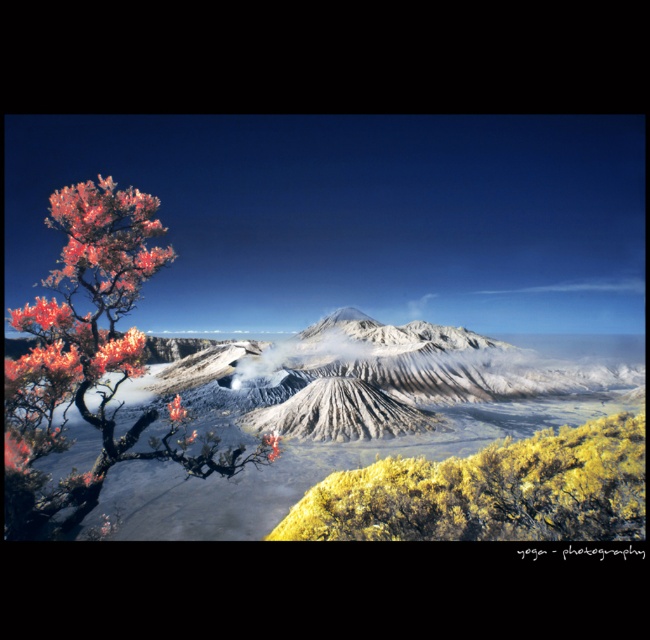
Question: Does fluorescent orange bark at left lie behind yellow-green shrubbery at lower right?

Choices:
 (A) no
 (B) yes

Answer: (B)

Question: Is fluorescent orange bark at left wider than yellow-green shrubbery at lower right?

Choices:
 (A) no
 (B) yes

Answer: (B)

Question: Is fluorescent orange bark at left above yellow-green shrubbery at lower right?

Choices:
 (A) yes
 (B) no

Answer: (A)

Question: Which object is closer to the camera taking this photo?

Choices:
 (A) yellow-green shrubbery at lower right
 (B) fluorescent orange bark at left

Answer: (A)